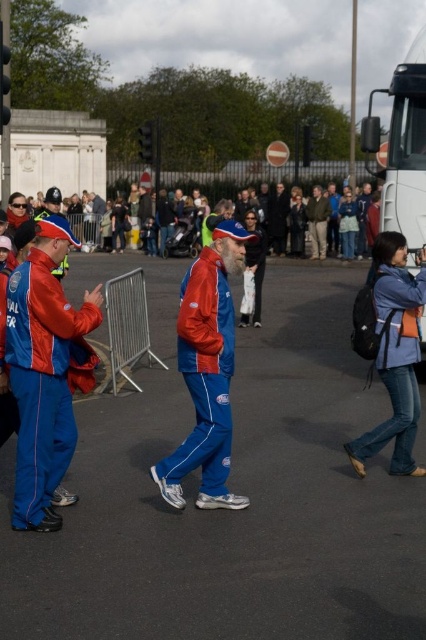
Question: Which point appears farthest from the camera in this image?

Choices:
 (A) (276, 221)
 (B) (37, 326)
 (C) (327, 200)

Answer: (A)

Question: Can you confirm if matte blue jumpsuit at left is positioned above dark gray suit at center?

Choices:
 (A) no
 (B) yes

Answer: (A)

Question: Can you confirm if matte blue tracksuit at center is thinner than matte blue jacket at center?

Choices:
 (A) no
 (B) yes

Answer: (B)

Question: Can you confirm if matte blue tracksuit at center is bigger than matte blue jacket at center?

Choices:
 (A) yes
 (B) no

Answer: (B)

Question: Which point appears closest to the camera in this image?

Choices:
 (A) (40, 492)
 (B) (95, 234)
 (C) (310, 234)

Answer: (A)

Question: Among these points, which one is nearest to the camera?

Choices:
 (A) (210, 465)
 (B) (327, 220)

Answer: (A)